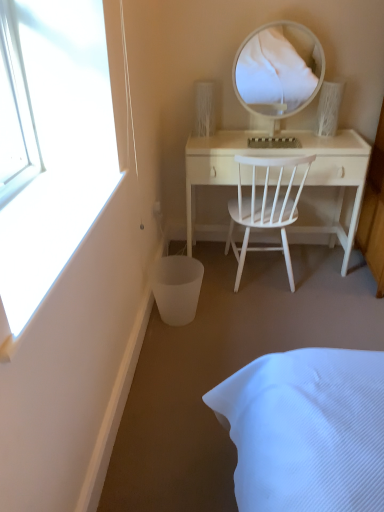
Question: Can you confirm if white glossy mirror at upper center is smaller than white wood chair at center?

Choices:
 (A) yes
 (B) no

Answer: (A)

Question: Does white glossy mirror at upper center have a greater height compared to white wood chair at center?

Choices:
 (A) yes
 (B) no

Answer: (B)

Question: Is there a large distance between white glossy mirror at upper center and white wood chair at center?

Choices:
 (A) yes
 (B) no

Answer: (A)

Question: From a real-world perspective, does white glossy mirror at upper center stand above white wood chair at center?

Choices:
 (A) no
 (B) yes

Answer: (B)

Question: Does white glossy mirror at upper center touch white wood chair at center?

Choices:
 (A) yes
 (B) no

Answer: (B)

Question: Does white glossy mirror at upper center have a lesser height compared to white wood chair at center?

Choices:
 (A) no
 (B) yes

Answer: (B)

Question: From the image's perspective, is white wood desk at center below white wood chair at center?

Choices:
 (A) no
 (B) yes

Answer: (A)

Question: Does white wood desk at center appear on the right side of white wood chair at center?

Choices:
 (A) no
 (B) yes

Answer: (B)

Question: Could you tell me if white wood desk at center is turned towards white wood chair at center?

Choices:
 (A) no
 (B) yes

Answer: (B)

Question: Does white wood desk at center come in front of white wood chair at center?

Choices:
 (A) yes
 (B) no

Answer: (B)

Question: Can you confirm if white wood desk at center is wider than white wood chair at center?

Choices:
 (A) no
 (B) yes

Answer: (A)

Question: Is white wood desk at center touching white wood chair at center?

Choices:
 (A) no
 (B) yes

Answer: (A)

Question: From a real-world perspective, is white wood desk at center positioned under white glossy mirror at upper center based on gravity?

Choices:
 (A) yes
 (B) no

Answer: (A)